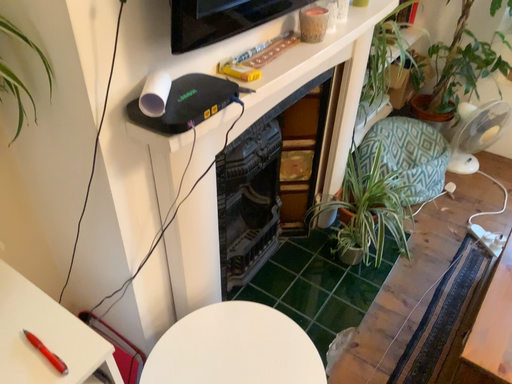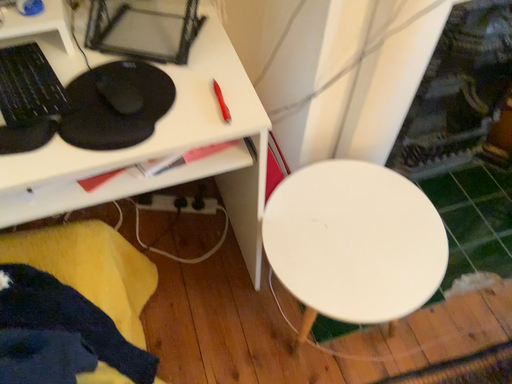
Question: How did the camera likely rotate when shooting the video?

Choices:
 (A) rotated right
 (B) rotated left

Answer: (B)